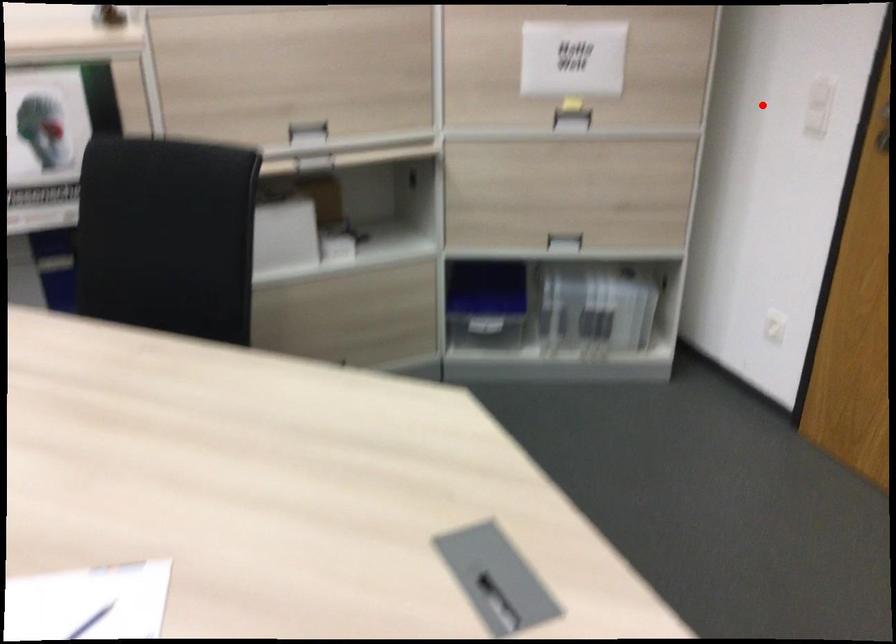
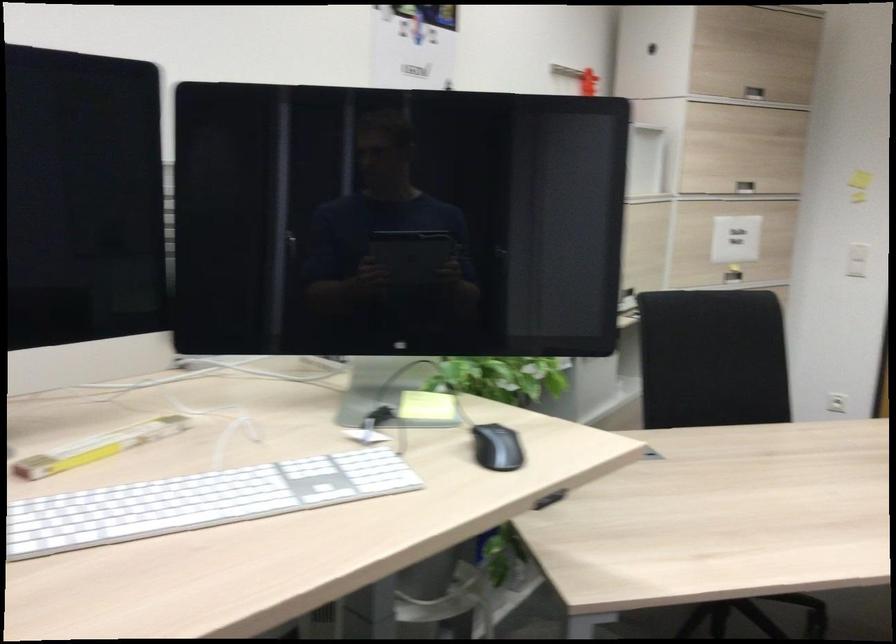
Question: I am providing you with two images of the same scene from different viewpoints. In image1, a red point is highlighted. Considering the same 3D point in image2, which of the following is correct?

Choices:
 (A) It is closer
 (B) It is farther

Answer: (B)